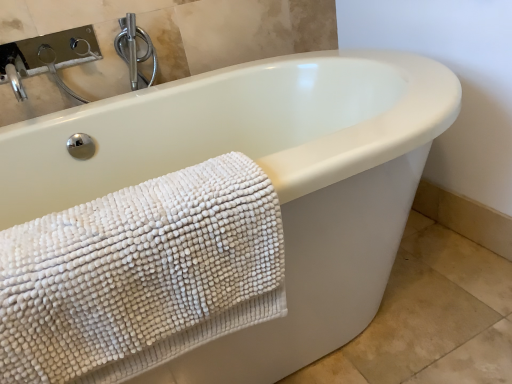
Question: From the image's perspective, is white chenille towel at lower left above or below satin nickel faucet at upper left?

Choices:
 (A) above
 (B) below

Answer: (B)

Question: From a real-world perspective, is white chenille towel at lower left above or below satin nickel faucet at upper left?

Choices:
 (A) below
 (B) above

Answer: (A)

Question: Looking at their shapes, would you say white chenille towel at lower left is wider or thinner than satin nickel faucet at upper left?

Choices:
 (A) wide
 (B) thin

Answer: (A)

Question: Which is correct: satin nickel faucet at upper left is inside white chenille towel at lower left, or outside of it?

Choices:
 (A) inside
 (B) outside

Answer: (B)

Question: Would you say satin nickel faucet at upper left is to the left or to the right of white chenille towel at lower left in the picture?

Choices:
 (A) left
 (B) right

Answer: (A)

Question: Considering the positions of satin nickel faucet at upper left and white chenille towel at lower left in the image, is satin nickel faucet at upper left taller or shorter than white chenille towel at lower left?

Choices:
 (A) tall
 (B) short

Answer: (B)

Question: Is satin nickel faucet at upper left in front of or behind white chenille towel at lower left in the image?

Choices:
 (A) behind
 (B) front

Answer: (A)